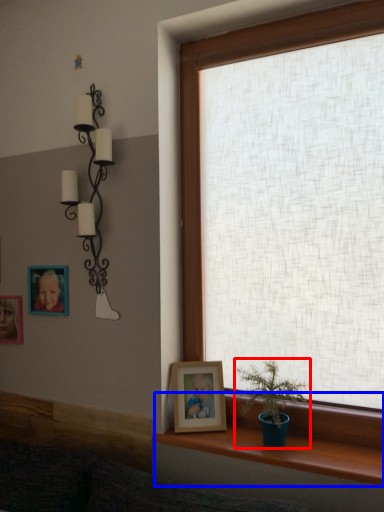
Question: Which object appears closest to the camera in this image, houseplant (highlighted by a red box) or window sill (highlighted by a blue box)?

Choices:
 (A) houseplant
 (B) window sill

Answer: (B)